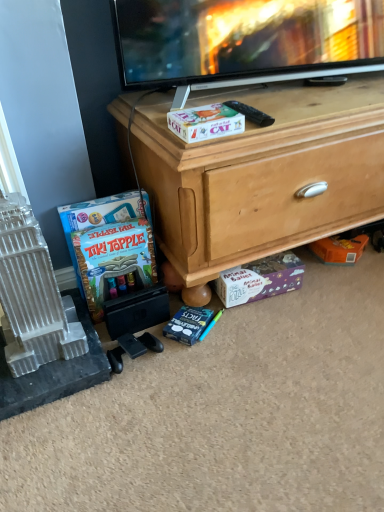
At what (x,y) coordinates should I click in order to perform the action: click on vacant space behind black plastic remote control at upper center. Please return your answer as a coordinate pair (x, y). The width and height of the screenshot is (384, 512). Looking at the image, I should click on coord(251,97).